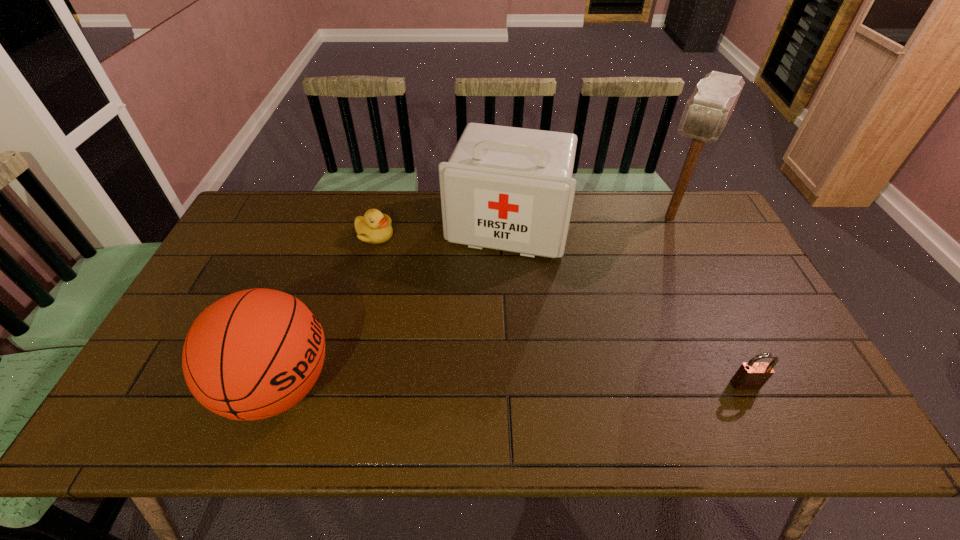
The image size is (960, 540). Find the location of `object that is the second closest to the basketball`. object that is the second closest to the basketball is located at coordinates (506, 188).

This screenshot has width=960, height=540. What are the coordinates of `object that stands as the second closest to the shortest object` in the screenshot? It's located at tap(251, 355).

This screenshot has width=960, height=540. Find the location of `free space that satisfies the following two spatial constraints: 1. on the back side of the shortest object; 2. on the left side of the third object from right to left`. free space that satisfies the following two spatial constraints: 1. on the back side of the shortest object; 2. on the left side of the third object from right to left is located at coordinates (377, 225).

At what (x,y) coordinates should I click in order to perform the action: click on vacant space that satisfies the following two spatial constraints: 1. on the back side of the shortest object; 2. on the right side of the mallet. Please return your answer as a coordinate pair (x, y). This screenshot has height=540, width=960. Looking at the image, I should click on (379, 217).